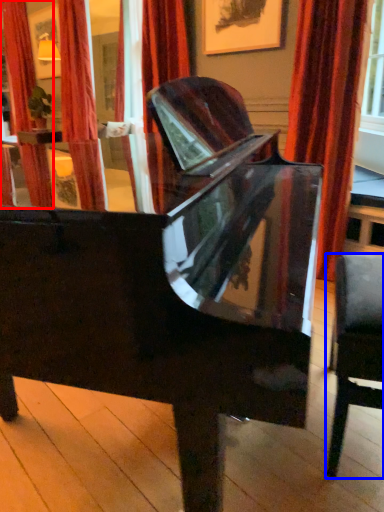
Question: Which point is further to the camera, curtain (highlighted by a red box) or chair (highlighted by a blue box)?

Choices:
 (A) curtain
 (B) chair

Answer: (A)